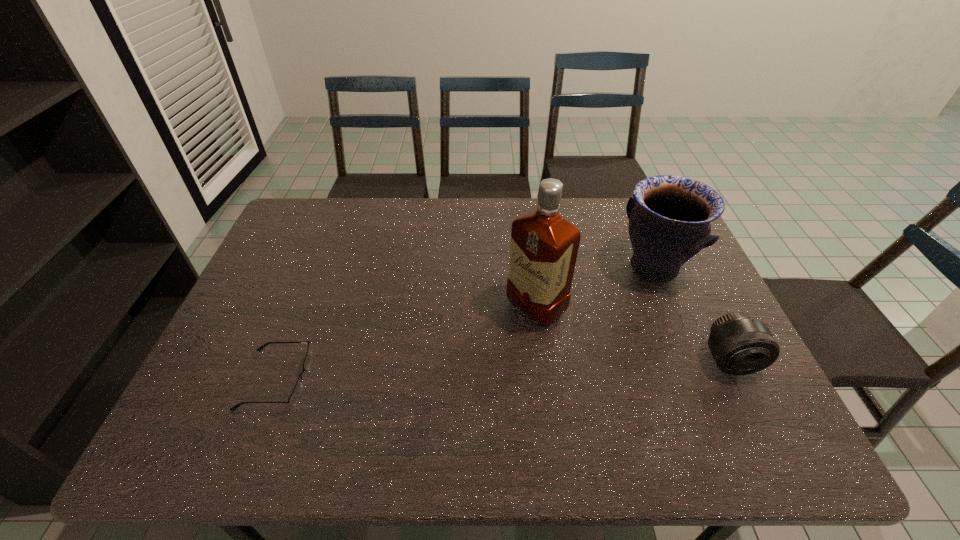
Image resolution: width=960 pixels, height=540 pixels. I want to click on spectacles, so 293,399.

Image resolution: width=960 pixels, height=540 pixels. In order to click on the leftmost object in this screenshot , I will do `click(293, 399)`.

What are the coordinates of `the third tallest object` in the screenshot? It's located at (740, 345).

Image resolution: width=960 pixels, height=540 pixels. Identify the location of the tallest object. (544, 245).

This screenshot has width=960, height=540. Find the location of `the second object from left to right`. the second object from left to right is located at coordinates (544, 245).

Image resolution: width=960 pixels, height=540 pixels. Identify the location of the second tallest object. (669, 216).

Find the location of a particular element. Image resolution: width=960 pixels, height=540 pixels. free region located 0.060m on the front-facing side of the spectacles is located at coordinates (333, 380).

Find the location of a particular element. vacant area situated 0.120m on the front label of the liquor is located at coordinates (483, 349).

Image resolution: width=960 pixels, height=540 pixels. I want to click on vacant space located on the front label of the liquor, so click(398, 414).

Find the location of a particular element. vacant area located on the front label of the liquor is located at coordinates (480, 351).